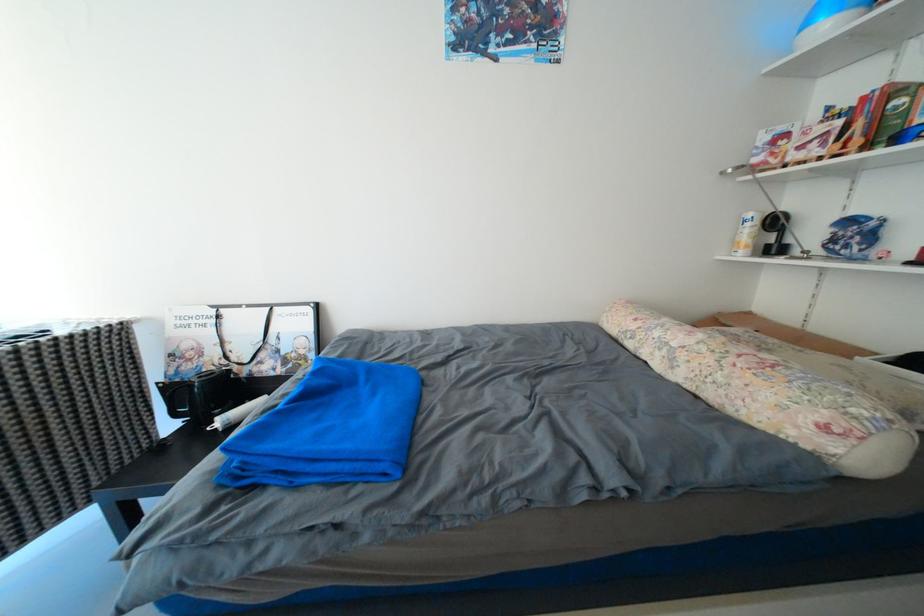
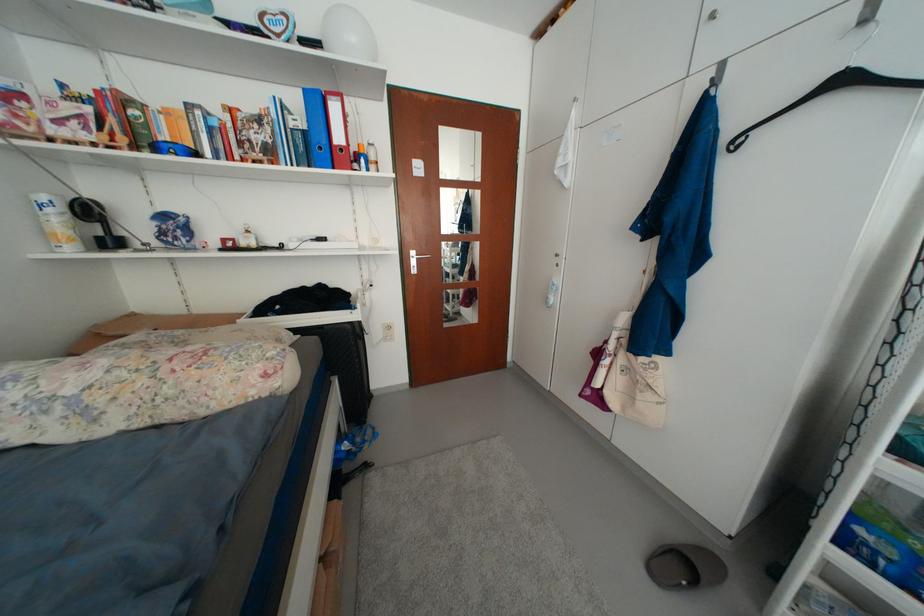
Based on the continuous images, in which direction is the camera rotating?

The camera's rotation is toward right-down.